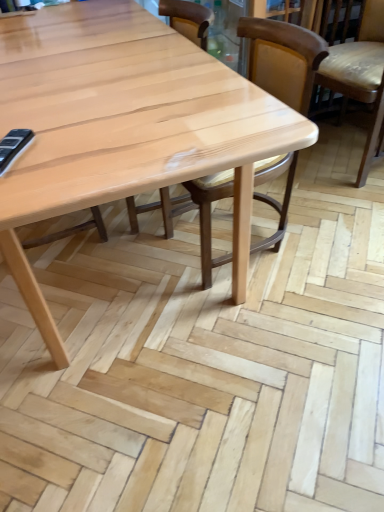
Question: From the image's perspective, would you say light brown leather chair at right, arranged as the first chair when viewed from the right, is shown under natural wood chair at center, which is the first chair in left-to-right order?

Choices:
 (A) no
 (B) yes

Answer: (A)

Question: Is light brown leather chair at right, arranged as the first chair when viewed from the right, shorter than natural wood chair at center, which is the first chair in left-to-right order?

Choices:
 (A) yes
 (B) no

Answer: (A)

Question: Considering the relative sizes of light brown leather chair at right, which is the 3th chair in left-to-right order, and natural wood chair at center, which is the first chair in left-to-right order, in the image provided, is light brown leather chair at right, which is the 3th chair in left-to-right order, wider than natural wood chair at center, which is the first chair in left-to-right order,?

Choices:
 (A) yes
 (B) no

Answer: (A)

Question: From a real-world perspective, is light brown leather chair at right, which is the 3th chair in left-to-right order, located beneath natural wood chair at center, which is the 3th chair in right-to-left order?

Choices:
 (A) yes
 (B) no

Answer: (B)

Question: Does light brown leather chair at right, which is the 3th chair in left-to-right order, have a lesser width compared to natural wood chair at center, which is the 3th chair in right-to-left order?

Choices:
 (A) yes
 (B) no

Answer: (B)

Question: Is light brown leather chair at right, arranged as the first chair when viewed from the right, oriented away from natural wood chair at center, which is the 3th chair in right-to-left order?

Choices:
 (A) yes
 (B) no

Answer: (B)

Question: From the image's perspective, is wooden chair at center, acting as the 2th chair starting from the left, under light brown leather chair at right, which is the 3th chair in left-to-right order?

Choices:
 (A) no
 (B) yes

Answer: (B)

Question: From the image's perspective, does wooden chair at center, placed as the second chair when sorted from right to left, appear higher than light brown leather chair at right, arranged as the first chair when viewed from the right?

Choices:
 (A) no
 (B) yes

Answer: (A)

Question: Is wooden chair at center, acting as the 2th chair starting from the left, not inside light brown leather chair at right, arranged as the first chair when viewed from the right?

Choices:
 (A) no
 (B) yes

Answer: (B)

Question: Considering the relative sizes of wooden chair at center, placed as the second chair when sorted from right to left, and light brown leather chair at right, arranged as the first chair when viewed from the right, in the image provided, is wooden chair at center, placed as the second chair when sorted from right to left, wider than light brown leather chair at right, arranged as the first chair when viewed from the right,?

Choices:
 (A) yes
 (B) no

Answer: (B)

Question: Is wooden chair at center, acting as the 2th chair starting from the left, smaller than light brown leather chair at right, which is the 3th chair in left-to-right order?

Choices:
 (A) no
 (B) yes

Answer: (B)

Question: Is wooden chair at center, placed as the second chair when sorted from right to left, next to light brown leather chair at right, arranged as the first chair when viewed from the right?

Choices:
 (A) no
 (B) yes

Answer: (A)

Question: Considering the relative sizes of wooden chair at center, placed as the second chair when sorted from right to left, and natural wood chair at center, which is the first chair in left-to-right order, in the image provided, is wooden chair at center, placed as the second chair when sorted from right to left, smaller than natural wood chair at center, which is the first chair in left-to-right order,?

Choices:
 (A) no
 (B) yes

Answer: (B)